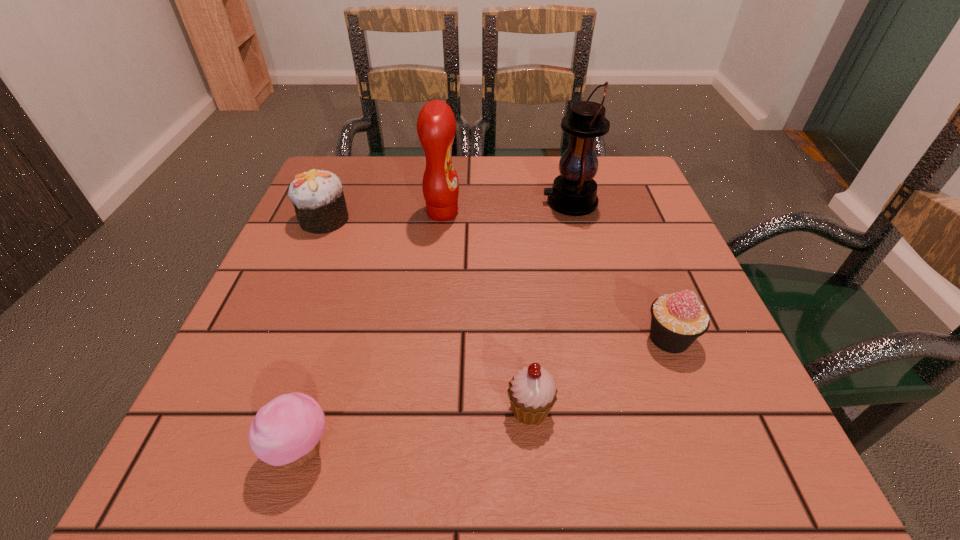
At what (x,y) coordinates should I click in order to perform the action: click on lantern. Please return your answer as a coordinate pair (x, y). The image size is (960, 540). Looking at the image, I should click on (574, 192).

This screenshot has height=540, width=960. Identify the location of the third object from left to right. (x=436, y=125).

Find the location of `the farthest cupcake`. the farthest cupcake is located at coordinates (317, 195).

Identify the location of the rightmost cupcake. This screenshot has height=540, width=960. (677, 320).

I want to click on the third nearest object, so click(677, 320).

Locate an element on the screen. This screenshot has width=960, height=540. the fourth object from left to right is located at coordinates (532, 392).

Locate several points within the vacant space situated 0.320m above the lantern, indicating its light source. Please provide its 2D coordinates. Your answer should be formatted as a tuple, i.e. [(x, y)], where the tuple contains the x and y coordinates of a point satisfying the conditions above.

[(405, 202)]

Identify some points in free space located 0.050m above the lantern, indicating its light source. Please provide its 2D coordinates. Your answer should be formatted as a tuple, i.e. [(x, y)], where the tuple contains the x and y coordinates of a point satisfying the conditions above.

[(521, 202)]

Identify some points in free space located above the lantern, indicating its light source. Please provide its 2D coordinates. Your answer should be formatted as a tuple, i.e. [(x, y)], where the tuple contains the x and y coordinates of a point satisfying the conditions above.

[(474, 202)]

Image resolution: width=960 pixels, height=540 pixels. Find the location of `free space located on the label side of the fourth object from right to left`. free space located on the label side of the fourth object from right to left is located at coordinates (615, 213).